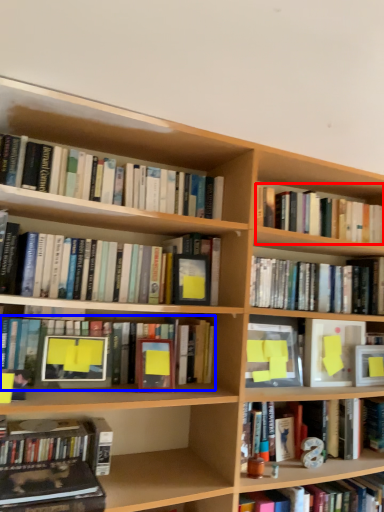
Question: Among these objects, which one is farthest to the camera, book (highlighted by a red box) or book (highlighted by a blue box)?

Choices:
 (A) book
 (B) book

Answer: (A)